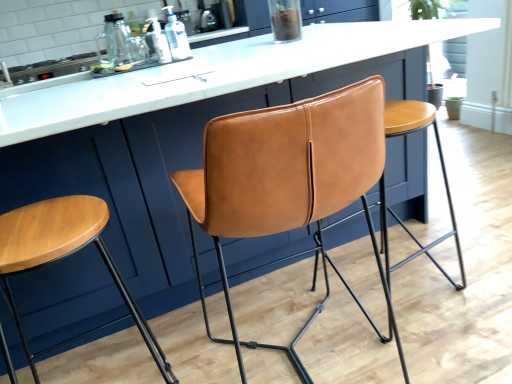
Identify the location of wooden stool at left, marked as the 2th stool in a right-to-left arrangement. Image resolution: width=512 pixels, height=384 pixels. coord(64,257).

Where is `cognac leather chair at center`? This screenshot has height=384, width=512. cognac leather chair at center is located at coordinates (291, 181).

The height and width of the screenshot is (384, 512). I want to click on matte leather stool at center, which is the 1th stool in right-to-left order, so coord(443,178).

Is cognac leather chair at center a part of metallic stove top at upper left?

No.

From a real-world perspective, which is physically above, metallic stove top at upper left or cognac leather chair at center?

In real-world perspective, metallic stove top at upper left is above.

Find the location of a particular element. The image size is (512, 384). appliance that appears behind the cognac leather chair at center is located at coordinates (53, 69).

From the picture: Between metallic stove top at upper left and cognac leather chair at center, which one has more height?

Standing taller between the two is cognac leather chair at center.

Which object is thinner, wooden stool at left, marked as the 2th stool in a right-to-left arrangement, or metallic stove top at upper left?

wooden stool at left, marked as the 2th stool in a right-to-left arrangement, is thinner.

Is point (12, 257) positioned after point (56, 64)?

No.

Considering the sizes of objects wooden stool at left, marked as the 2th stool in a right-to-left arrangement, and metallic stove top at upper left in the image provided, who is taller, wooden stool at left, marked as the 2th stool in a right-to-left arrangement, or metallic stove top at upper left?

wooden stool at left, marked as the 2th stool in a right-to-left arrangement.

Is wooden stool at left, marked as the 2th stool in a right-to-left arrangement, not within metallic stove top at upper left?

Absolutely, wooden stool at left, marked as the 2th stool in a right-to-left arrangement, is external to metallic stove top at upper left.

Could you tell me if matte leather stool at center, which is the 1th stool in right-to-left order, is turned towards wooden stool at left, marked as the 2th stool in a right-to-left arrangement?

No, matte leather stool at center, which is the 1th stool in right-to-left order, does not turn towards wooden stool at left, marked as the 2th stool in a right-to-left arrangement.

Is matte leather stool at center, the 2th stool in the left-to-right sequence, positioned beyond the bounds of wooden stool at left, which appears as the 1th stool when viewed from the left?

Yes.

From a real-world perspective, is matte leather stool at center, the 2th stool in the left-to-right sequence, above or below wooden stool at left, marked as the 2th stool in a right-to-left arrangement?

Clearly, from a real-world perspective, matte leather stool at center, the 2th stool in the left-to-right sequence, is below wooden stool at left, marked as the 2th stool in a right-to-left arrangement.

Is matte leather stool at center, the 2th stool in the left-to-right sequence, bigger than wooden stool at left, which appears as the 1th stool when viewed from the left?

No, matte leather stool at center, the 2th stool in the left-to-right sequence, is not bigger than wooden stool at left, which appears as the 1th stool when viewed from the left.

Who is taller, clear plastic bottle at center, the second bottle when ordered from left to right, or metallic stove top at upper left?

Standing taller between the two is clear plastic bottle at center, the second bottle when ordered from left to right.

Who is more distant, clear plastic bottle at center, which is the first bottle from right to left, or metallic stove top at upper left?

metallic stove top at upper left is behind.

From the picture: Is clear plastic bottle at center, which is the first bottle from right to left, wider or thinner than metallic stove top at upper left?

clear plastic bottle at center, which is the first bottle from right to left, is thinner than metallic stove top at upper left.

Where is `bottle that is the 2nd object above the metallic stove top at upper left (from a real-world perspective)`? The width and height of the screenshot is (512, 384). bottle that is the 2nd object above the metallic stove top at upper left (from a real-world perspective) is located at coordinates (176, 37).

From the image's perspective, which one is positioned higher, cognac leather chair at center or metallic stove top at upper left?

metallic stove top at upper left appears higher in the image.

Looking at this image, could you tell me if cognac leather chair at center is turned towards metallic stove top at upper left?

Yes, cognac leather chair at center is facing metallic stove top at upper left.

Does cognac leather chair at center come behind metallic stove top at upper left?

No, cognac leather chair at center is closer to the viewer.

Can you see cognac leather chair at center touching metallic stove top at upper left?

No, cognac leather chair at center is not in contact with metallic stove top at upper left.

Is metallic stove top at upper left oriented away from clear plastic bottle at center, the second bottle when ordered from left to right?

metallic stove top at upper left is not turned away from clear plastic bottle at center, the second bottle when ordered from left to right.

How much distance is there between metallic stove top at upper left and clear plastic bottle at center, the second bottle when ordered from left to right?

metallic stove top at upper left and clear plastic bottle at center, the second bottle when ordered from left to right, are 1.38 meters apart from each other.

Looking at their sizes, would you say metallic stove top at upper left is wider or thinner than clear plastic bottle at center, which is the first bottle from right to left?

Clearly, metallic stove top at upper left has more width compared to clear plastic bottle at center, which is the first bottle from right to left.

Is metallic stove top at upper left inside or outside of clear plastic bottle at center, the second bottle when ordered from left to right?

metallic stove top at upper left is spatially situated outside clear plastic bottle at center, the second bottle when ordered from left to right.

Which of these two, cognac leather chair at center or translucent plastic bottle at upper center, which is the 1th bottle in left-to-right order, is smaller?

With smaller size is translucent plastic bottle at upper center, which is the 1th bottle in left-to-right order.

Is cognac leather chair at center with translucent plastic bottle at upper center, which is the 1th bottle in left-to-right order?

No, cognac leather chair at center is not with translucent plastic bottle at upper center, which is the 1th bottle in left-to-right order.

Which object is positioned more to the left, cognac leather chair at center or translucent plastic bottle at upper center, which is the 1th bottle in left-to-right order?

translucent plastic bottle at upper center, which is the 1th bottle in left-to-right order.

Is cognac leather chair at center positioned with its back to translucent plastic bottle at upper center, marked as the second bottle in a right-to-left arrangement?

No, cognac leather chair at center's orientation is not away from translucent plastic bottle at upper center, marked as the second bottle in a right-to-left arrangement.

This screenshot has width=512, height=384. In order to click on appliance behind the cognac leather chair at center in this screenshot , I will do `click(53, 69)`.

At what (x,y) coordinates should I click in order to perform the action: click on appliance on the left of wooden stool at left, which appears as the 1th stool when viewed from the left. Please return your answer as a coordinate pair (x, y). This screenshot has width=512, height=384. Looking at the image, I should click on (53, 69).

From the picture: Based on their spatial positions, is clear plastic bottle at center, which is the first bottle from right to left, or cognac leather chair at center further from metallic stove top at upper left?

Among the two, cognac leather chair at center is located further to metallic stove top at upper left.

Based on the photo, estimate the real-world distances between objects in this image. Which object is closer to metallic stove top at upper left, clear plastic bottle at center, which is the first bottle from right to left, or wooden stool at left, marked as the 2th stool in a right-to-left arrangement?

clear plastic bottle at center, which is the first bottle from right to left, lies closer to metallic stove top at upper left than the other object.

From the image, which object appears to be farther from translucent plastic bottle at upper center, marked as the second bottle in a right-to-left arrangement, metallic stove top at upper left or cognac leather chair at center?

→ cognac leather chair at center lies further to translucent plastic bottle at upper center, marked as the second bottle in a right-to-left arrangement, than the other object.

Looking at the image, which one is located closer to clear plastic bottle at center, which is the first bottle from right to left, cognac leather chair at center or translucent plastic bottle at upper center, which is the 1th bottle in left-to-right order?

translucent plastic bottle at upper center, which is the 1th bottle in left-to-right order, is positioned closer to the anchor clear plastic bottle at center, which is the first bottle from right to left.

Which object lies further to the anchor point wooden stool at left, marked as the 2th stool in a right-to-left arrangement, metallic stove top at upper left or cognac leather chair at center?

Based on the image, metallic stove top at upper left appears to be further to wooden stool at left, marked as the 2th stool in a right-to-left arrangement.

Looking at the image, which one is located closer to translucent plastic bottle at upper center, which is the 1th bottle in left-to-right order, wooden stool at left, marked as the 2th stool in a right-to-left arrangement, or matte leather stool at center, the 2th stool in the left-to-right sequence?

wooden stool at left, marked as the 2th stool in a right-to-left arrangement, lies closer to translucent plastic bottle at upper center, which is the 1th bottle in left-to-right order, than the other object.

From the image, which object appears to be farther from translucent plastic bottle at upper center, which is the 1th bottle in left-to-right order, clear plastic bottle at center, the second bottle when ordered from left to right, or metallic stove top at upper left?

metallic stove top at upper left is further to translucent plastic bottle at upper center, which is the 1th bottle in left-to-right order.

When comparing their distances from matte leather stool at center, which is the 1th stool in right-to-left order, does metallic stove top at upper left or clear plastic bottle at center, which is the first bottle from right to left, seem closer?

The object closer to matte leather stool at center, which is the 1th stool in right-to-left order, is clear plastic bottle at center, which is the first bottle from right to left.

This screenshot has height=384, width=512. What are the coordinates of `stool that lies between clear plastic bottle at center, the second bottle when ordered from left to right, and wooden stool at left, marked as the 2th stool in a right-to-left arrangement, from top to bottom` in the screenshot? It's located at (443, 178).

You are a GUI agent. You are given a task and a screenshot of the screen. Output one action in this format:
    pyautogui.click(x=<x>, y=<y>)
    Task: Click on the bottle positioned between cognac leather chair at center and clear plastic bottle at center, the second bottle when ordered from left to right, from near to far
    Image resolution: width=512 pixels, height=384 pixels.
    Given the screenshot: What is the action you would take?
    pyautogui.click(x=158, y=41)

At what (x,y) coordinates should I click in order to perform the action: click on chair between wooden stool at left, which appears as the 1th stool when viewed from the left, and metallic stove top at upper left in the front-back direction. Please return your answer as a coordinate pair (x, y). Looking at the image, I should click on (291, 181).

Image resolution: width=512 pixels, height=384 pixels. What are the coordinates of `chair between wooden stool at left, marked as the 2th stool in a right-to-left arrangement, and translucent plastic bottle at upper center, marked as the second bottle in a right-to-left arrangement, in the front-back direction` in the screenshot? It's located at (291, 181).